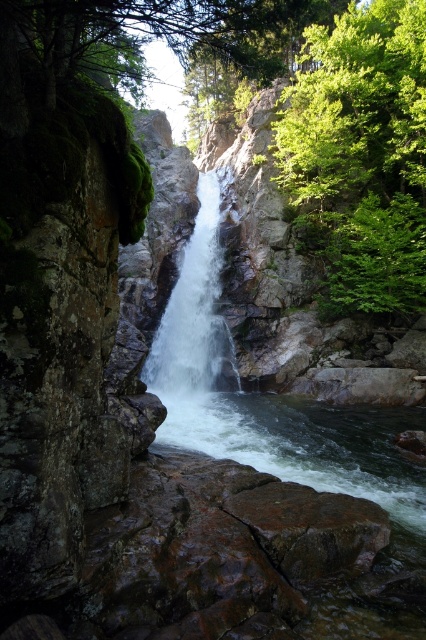
Measure the distance between point (305, 131) and camera.

Point (305, 131) is 23.40 meters away from camera.

Does green leafy tree at right appear on the left side of clear water at center?

Incorrect, green leafy tree at right is not on the left side of clear water at center.

Identify the location of green leafy tree at right. pos(362,152).

How distant is clear water at center from white smooth waterfall at center?

The distance of clear water at center from white smooth waterfall at center is 6.04 meters.

Between point (288, 404) and point (222, 388), which one is positioned in front?

Point (288, 404) is more forward.

Between point (365, 460) and point (155, 356), which one is positioned in front?

Positioned in front is point (365, 460).

Locate an element on the screen. clear water at center is located at coordinates (307, 444).

Which is below, green leafy tree at right or white smooth waterfall at center?

white smooth waterfall at center

Measure the distance between green leafy tree at right and camera.

17.99 meters

Which is in front, point (365, 124) or point (149, 378)?

Point (149, 378) is in front.

The width and height of the screenshot is (426, 640). What are the coordinates of `green leafy tree at right` in the screenshot? It's located at (362, 152).